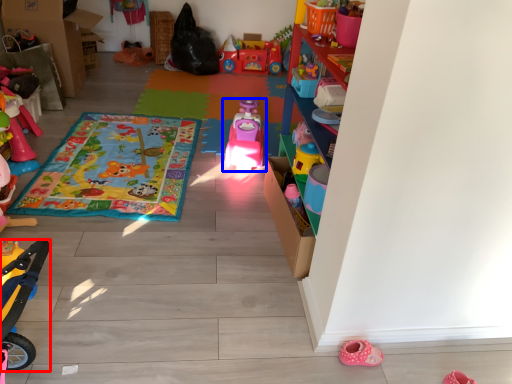
Question: Among these objects, which one is farthest to the camera, toy (highlighted by a red box) or toy (highlighted by a blue box)?

Choices:
 (A) toy
 (B) toy

Answer: (B)